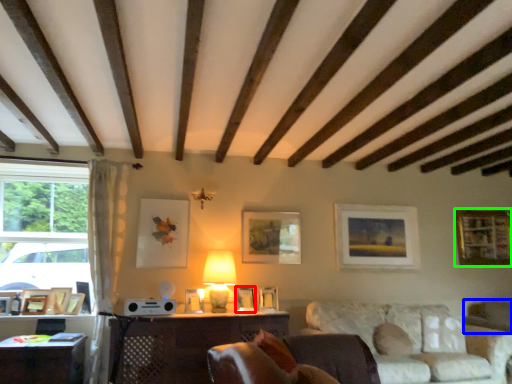
Question: Based on their relative distances, which object is nearer to picture frame (highlighted by a red box)? Choose from swivel chair (highlighted by a blue box) and picture frame (highlighted by a green box).

Choices:
 (A) swivel chair
 (B) picture frame

Answer: (A)